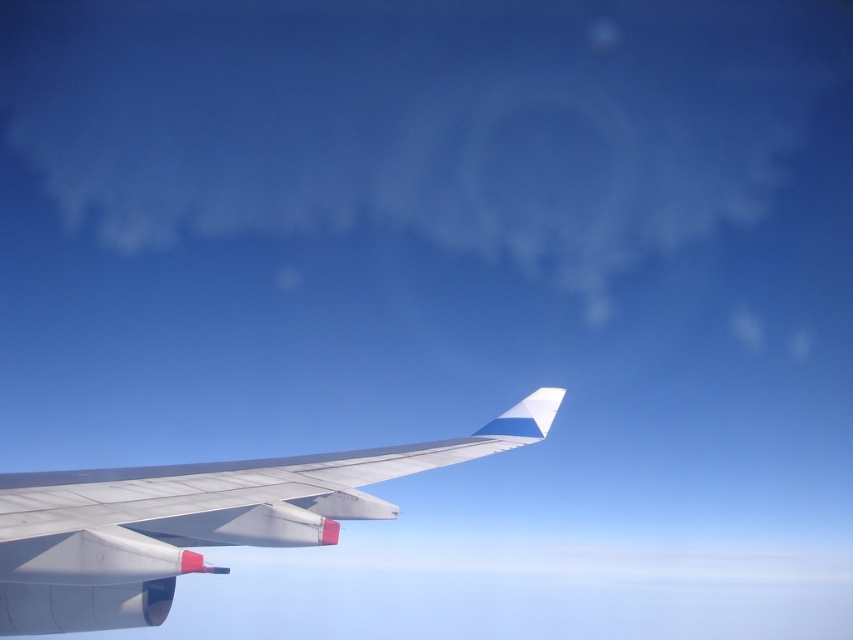
Does white fluffy cloud at upper center have a larger size compared to metallic gray wing at center?

Yes, white fluffy cloud at upper center is bigger than metallic gray wing at center.

Does white fluffy cloud at upper center have a lesser height compared to metallic gray wing at center?

In fact, white fluffy cloud at upper center may be taller than metallic gray wing at center.

Does point (602, 166) lie in front of point (28, 616)?

That is False.

Locate an element on the screen. Image resolution: width=853 pixels, height=640 pixels. white fluffy cloud at upper center is located at coordinates (421, 120).